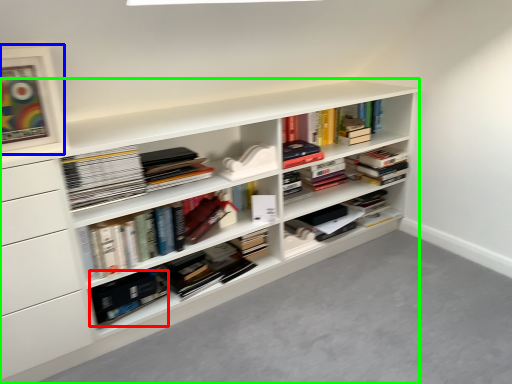
Question: Which is nearer to the paperback book (highlighted by a red box)? picture frame (highlighted by a blue box) or shelf (highlighted by a green box).

Choices:
 (A) picture frame
 (B) shelf

Answer: (B)